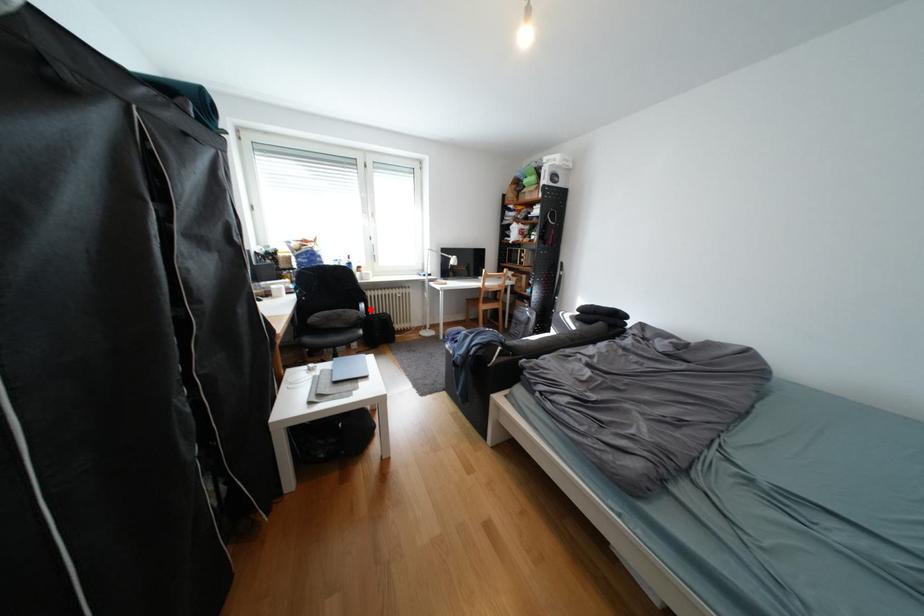
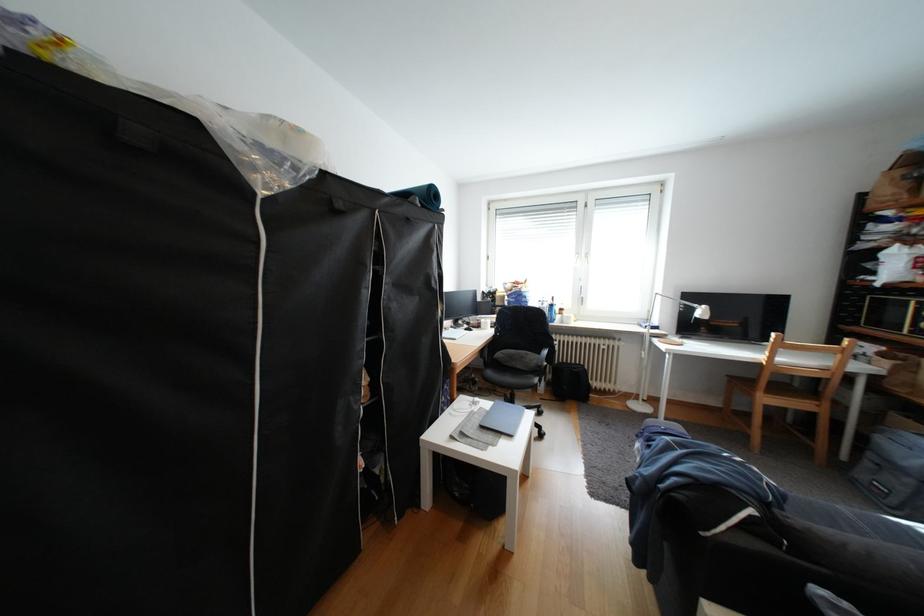
Question: A red point is marked in image1. In image2, is the corresponding 3D point closer to the camera or farther? Reply with the corresponding letter.

Choices:
 (A) The corresponding 3D point is closer.
 (B) The corresponding 3D point is farther.

Answer: (B)